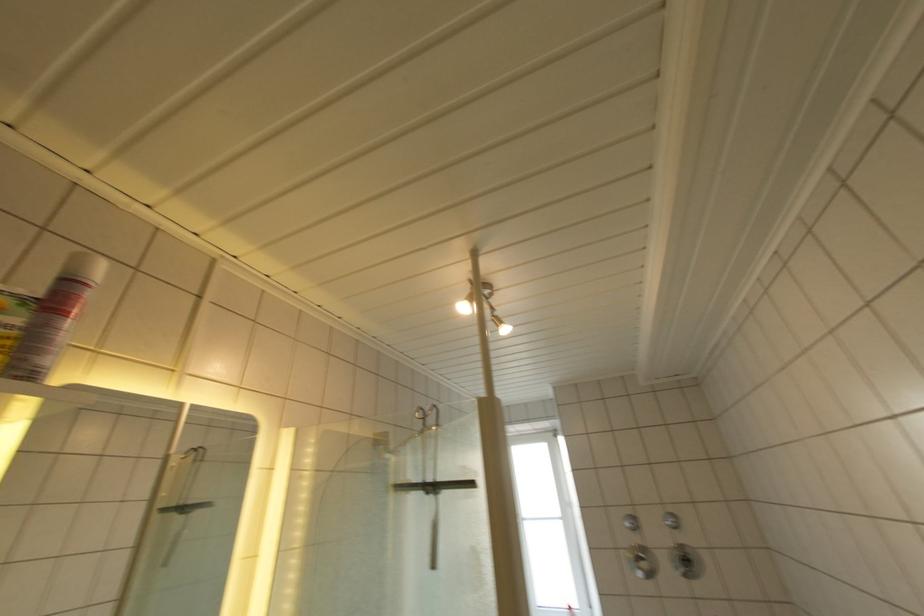
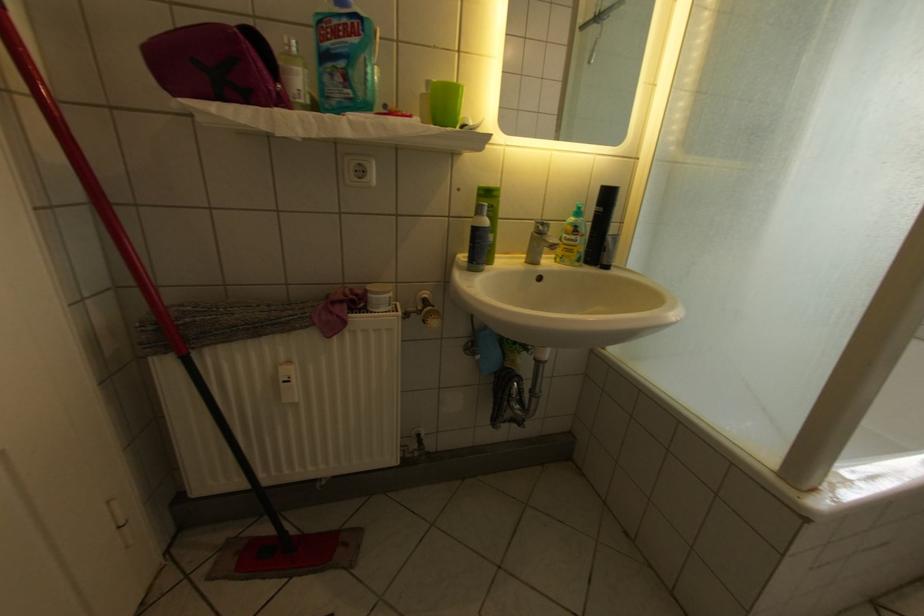
First-person continuous shooting, in which direction is the camera rotating?

The camera's rotation is toward left-down.